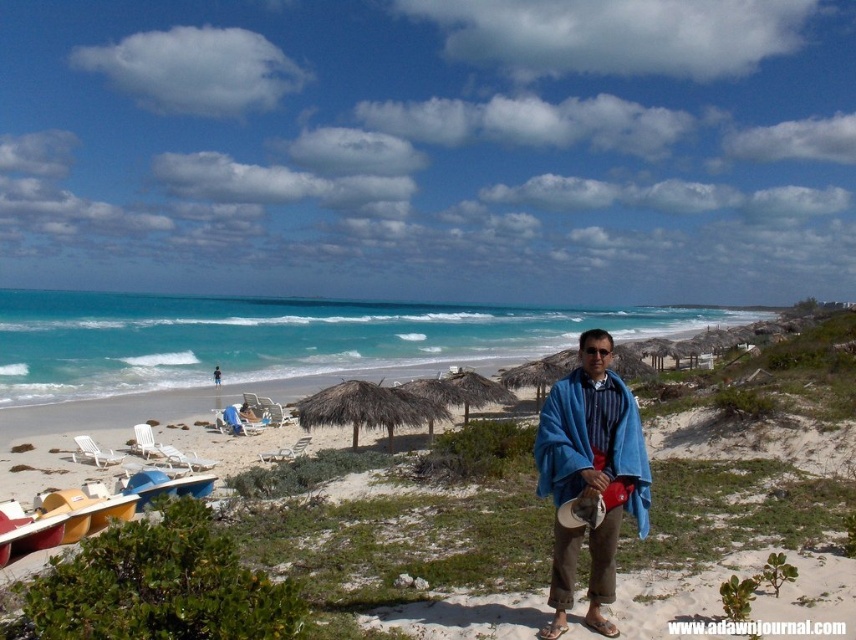
Question: Does smooth sand beach at center have a smaller size compared to blue fabric towel at center?

Choices:
 (A) yes
 (B) no

Answer: (B)

Question: Which point appears closest to the camera in this image?

Choices:
 (A) (551, 444)
 (B) (776, 433)

Answer: (A)

Question: Which of the following is the farthest from the observer?

Choices:
 (A) (682, 428)
 (B) (605, 625)

Answer: (A)

Question: Which object appears closest to the camera in this image?

Choices:
 (A) smooth sand beach at center
 (B) blue fabric towel at center

Answer: (A)

Question: Does smooth sand beach at center appear on the right side of blue fabric towel at center?

Choices:
 (A) no
 (B) yes

Answer: (A)

Question: Does smooth sand beach at center come behind blue fabric towel at center?

Choices:
 (A) no
 (B) yes

Answer: (A)